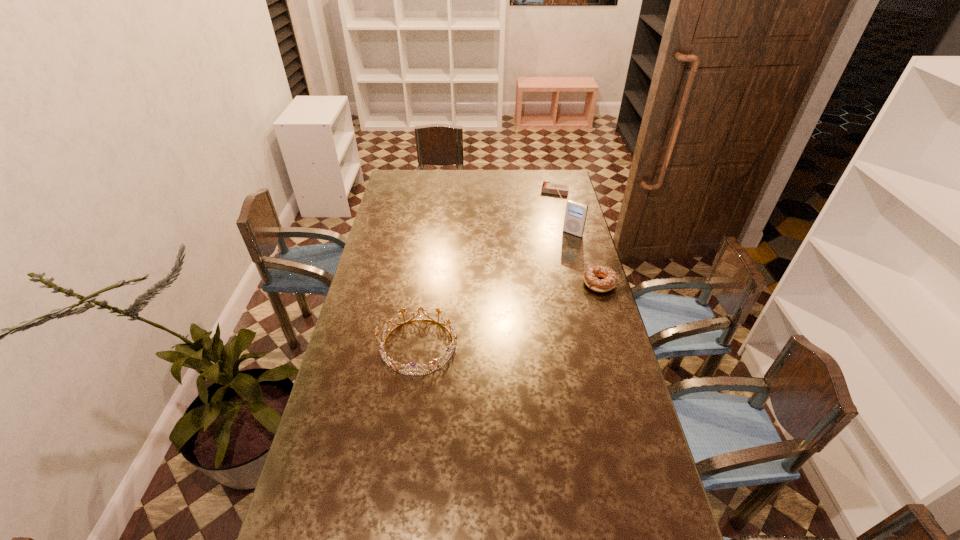
At what (x,y) coordinates should I click in order to perform the action: click on blank region between the tiara and the shortest object. Please return your answer as a coordinate pair (x, y). Looking at the image, I should click on (487, 269).

What are the coordinates of `vacant area that lies between the second shortest object and the iPod` in the screenshot? It's located at (587, 259).

Locate an element on the screen. The height and width of the screenshot is (540, 960). unoccupied area between the third farthest object and the third nearest object is located at coordinates (587, 259).

I want to click on free spot between the iPod and the doughnut, so click(587, 259).

The height and width of the screenshot is (540, 960). Identify the location of unoccupied position between the shortest object and the third nearest object. (564, 213).

Where is `vacant area between the shortest object and the doughnut`? The width and height of the screenshot is (960, 540). vacant area between the shortest object and the doughnut is located at coordinates (578, 238).

Find the location of a particular element. The width and height of the screenshot is (960, 540). free space that is in between the farthest object and the third farthest object is located at coordinates (578, 238).

The height and width of the screenshot is (540, 960). Identify the location of free point between the tiara and the third farthest object. (509, 315).

Select which object is the second closest to the leftmost object. Please provide its 2D coordinates. Your answer should be formatted as a tuple, i.e. [(x, y)], where the tuple contains the x and y coordinates of a point satisfying the conditions above.

[(575, 215)]

Find the location of a particular element. object that ranks as the second closest to the tallest object is located at coordinates (547, 187).